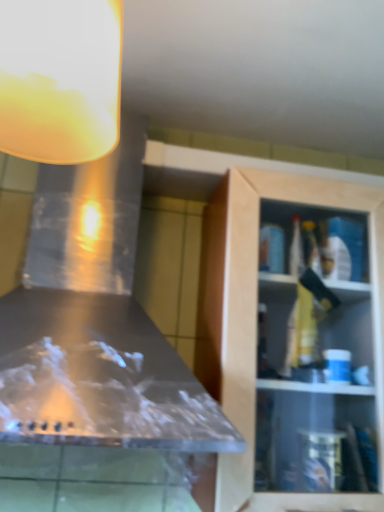
Question: From the image's perspective, is wooden cabinet at right on translucent glass lampshade at upper left?

Choices:
 (A) no
 (B) yes

Answer: (A)

Question: Does wooden cabinet at right have a greater width compared to translucent glass lampshade at upper left?

Choices:
 (A) yes
 (B) no

Answer: (A)

Question: Is wooden cabinet at right at the left side of translucent glass lampshade at upper left?

Choices:
 (A) no
 (B) yes

Answer: (A)

Question: Is wooden cabinet at right smaller than translucent glass lampshade at upper left?

Choices:
 (A) no
 (B) yes

Answer: (A)

Question: Considering the relative sizes of wooden cabinet at right and translucent glass lampshade at upper left in the image provided, is wooden cabinet at right thinner than translucent glass lampshade at upper left?

Choices:
 (A) no
 (B) yes

Answer: (A)

Question: Is the surface of wooden cabinet at right in direct contact with translucent glass lampshade at upper left?

Choices:
 (A) no
 (B) yes

Answer: (A)

Question: Does translucent glass lampshade at upper left lie in front of wooden cabinet at right?

Choices:
 (A) no
 (B) yes

Answer: (B)

Question: From the image's perspective, is translucent glass lampshade at upper left under wooden cabinet at right?

Choices:
 (A) no
 (B) yes

Answer: (A)

Question: Considering the relative sizes of translucent glass lampshade at upper left and wooden cabinet at right in the image provided, is translucent glass lampshade at upper left taller than wooden cabinet at right?

Choices:
 (A) no
 (B) yes

Answer: (A)

Question: Can you confirm if translucent glass lampshade at upper left is bigger than wooden cabinet at right?

Choices:
 (A) yes
 (B) no

Answer: (B)

Question: Is the depth of translucent glass lampshade at upper left greater than that of wooden cabinet at right?

Choices:
 (A) no
 (B) yes

Answer: (A)

Question: Is translucent glass lampshade at upper left with wooden cabinet at right?

Choices:
 (A) no
 (B) yes

Answer: (A)

Question: From their relative heights in the image, would you say translucent glass lampshade at upper left is taller or shorter than wooden cabinet at right?

Choices:
 (A) short
 (B) tall

Answer: (A)